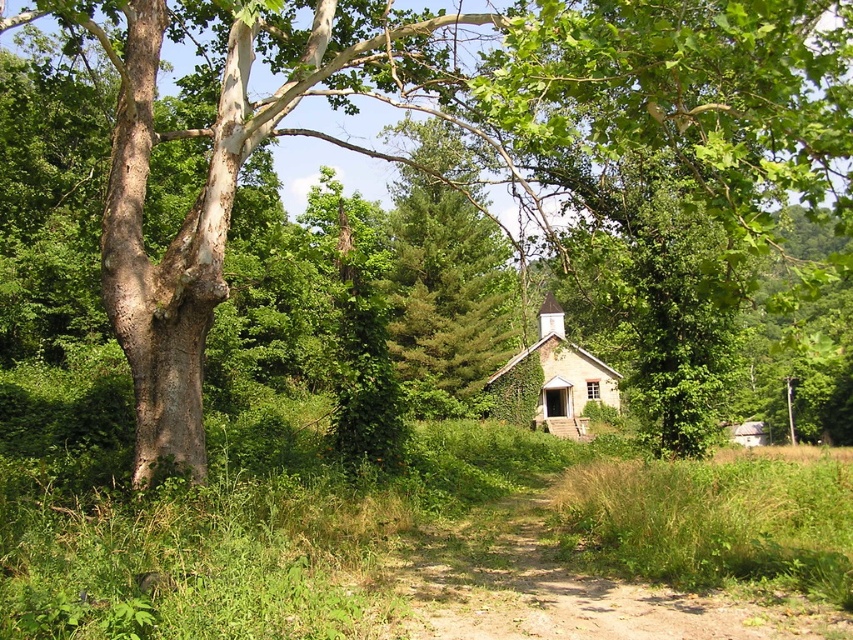
You are a hiker who wants to walk along the brown dirt track at center. However, you notice the smooth bark tree at left might block your path. Based on their positions, can you walk under the tree without hitting your head?

The smooth bark tree at left is above the brown dirt track at center, so yes, you can walk under the tree without hitting your head as the tree extends over the path.